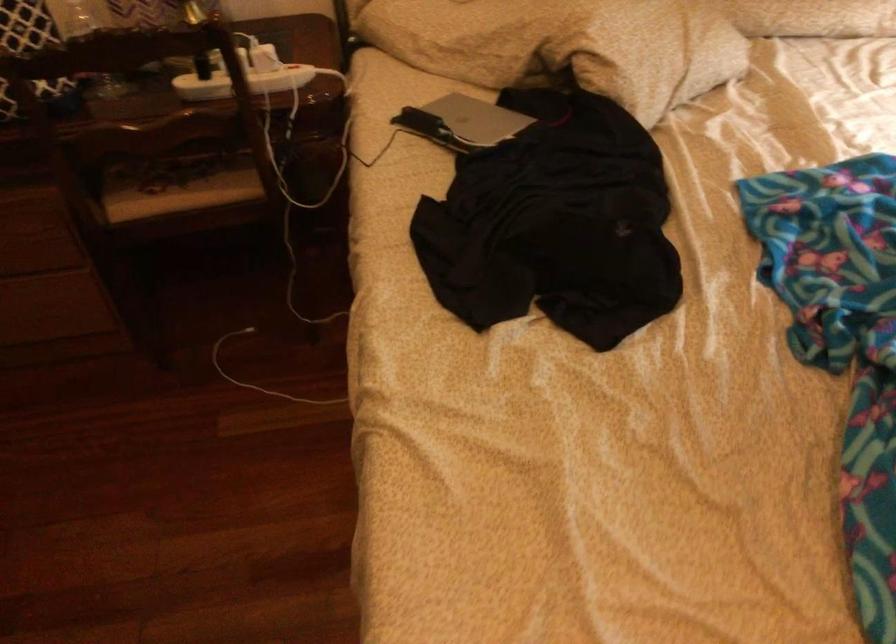
The height and width of the screenshot is (644, 896). Identify the location of white charging cable. 291,240.